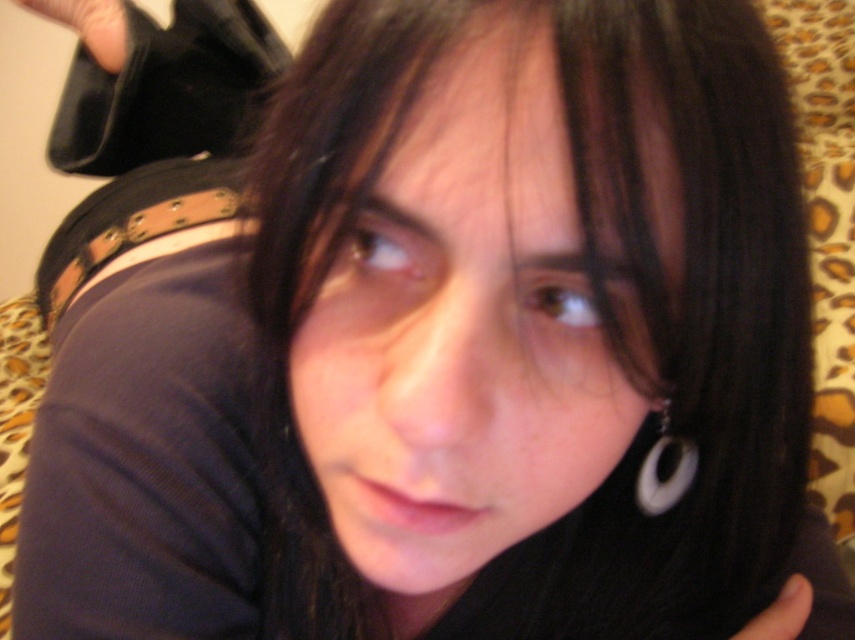
Which is more to the left, smooth skin face at center or white plastic hoop at lower right?

smooth skin face at center is more to the left.

Does smooth skin face at center appear under white plastic hoop at lower right?

No.

Is point (528, 96) positioned in front of point (665, 465)?

Yes, it is.

This screenshot has width=855, height=640. I want to click on smooth skin face at center, so click(467, 326).

Can you confirm if smooth skin face at center is smaller than black leather bag at upper left?

Yes, smooth skin face at center is smaller than black leather bag at upper left.

Between point (305, 410) and point (127, 28), which one is positioned behind?

Point (127, 28)

Find the location of a particular element. This screenshot has height=640, width=855. smooth skin face at center is located at coordinates (467, 326).

Is black leather bag at upper left further to camera compared to black matte finger at lower right?

That is True.

Is black leather bag at upper left below black matte finger at lower right?

Actually, black leather bag at upper left is above black matte finger at lower right.

Measure the distance between black leather bag at upper left and camera.

black leather bag at upper left and camera are 35.85 inches apart from each other.

Find the location of a particular element. The height and width of the screenshot is (640, 855). black leather bag at upper left is located at coordinates (89, 26).